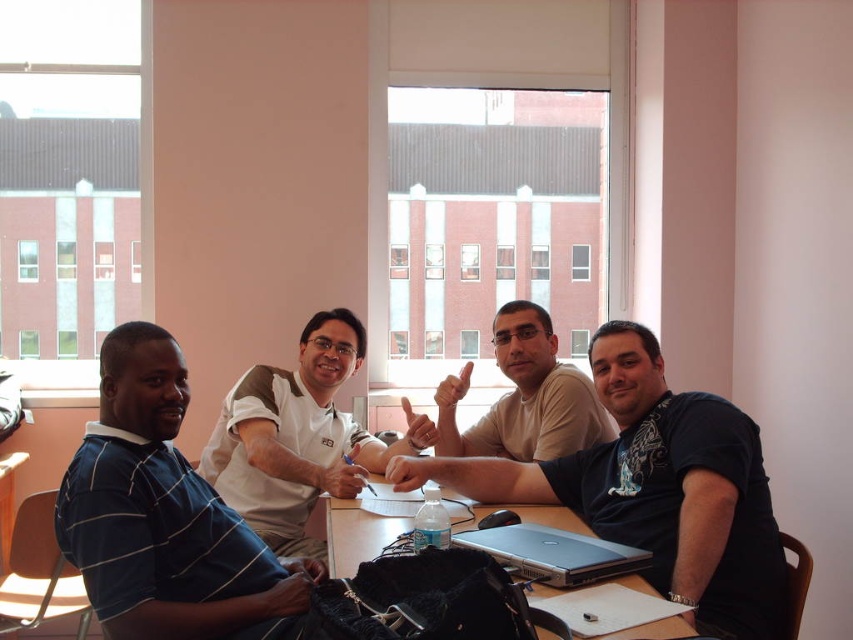
You are standing at the entrance of the room and want to greet the person wearing the blue striped shirt at left. Based on their position relative to the entrance, in which general direction should you walk to reach them?

The blue striped shirt at left is located at point (164, 515), which would be to your left side as you face into the room. Walk towards the left side of the room to reach them.